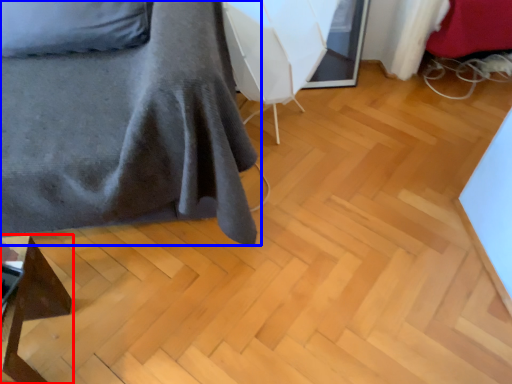
Question: Which object is further to the camera taking this photo, furniture (highlighted by a red box) or furniture (highlighted by a blue box)?

Choices:
 (A) furniture
 (B) furniture

Answer: (A)